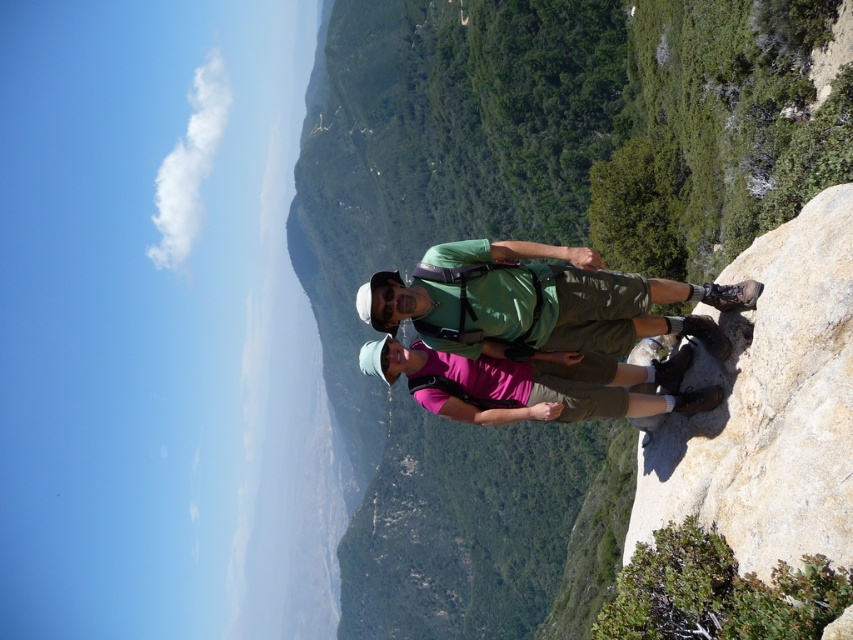
Does point (397, 484) come behind point (552, 364)?

Yes.

Which is behind, point (519, 170) or point (496, 387)?

The point (519, 170) is behind.

Where is `green leafy mountain at center`? The image size is (853, 640). green leafy mountain at center is located at coordinates (531, 237).

Is point (549, 332) closer to viewer compared to point (540, 364)?

Yes.

How much distance is there between green matte shirt at center and pink fabric shirt at center?

A distance of 1.34 meters exists between green matte shirt at center and pink fabric shirt at center.

Which is behind, point (479, 243) or point (701, 392)?

The point (701, 392) is more distant.

This screenshot has width=853, height=640. What are the coordinates of `green matte shirt at center` in the screenshot? It's located at (535, 300).

How much distance is there between green leafy mountain at center and green matte shirt at center?

The distance of green leafy mountain at center from green matte shirt at center is 407.06 meters.

Consider the image. Between green leafy mountain at center and green matte shirt at center, which one appears on the right side from the viewer's perspective?

green matte shirt at center is more to the right.

In order to click on green leafy mountain at center in this screenshot , I will do `click(531, 237)`.

The height and width of the screenshot is (640, 853). Find the location of `green leafy mountain at center`. green leafy mountain at center is located at coordinates (531, 237).